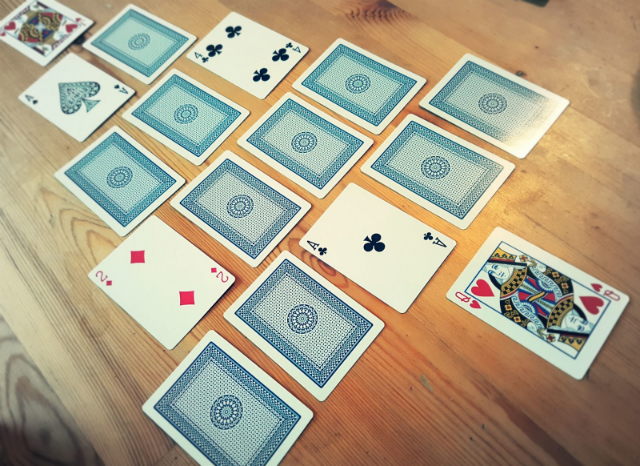
Identify the location of wooden boards. click(22, 423), click(68, 367), click(178, 458), click(385, 412), click(456, 330), click(557, 215), click(582, 62), click(589, 27).